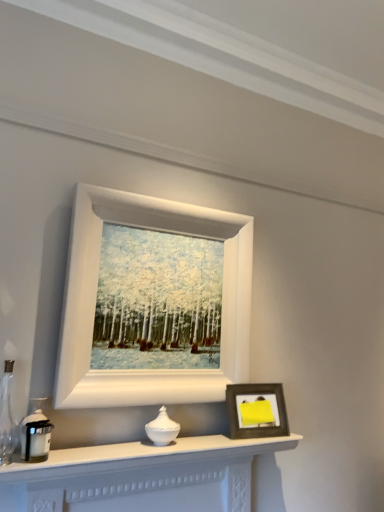
Image resolution: width=384 pixels, height=512 pixels. I want to click on free location to the right of white glossy vase at center, which is counted as the second candle holder, starting from the left, so click(210, 439).